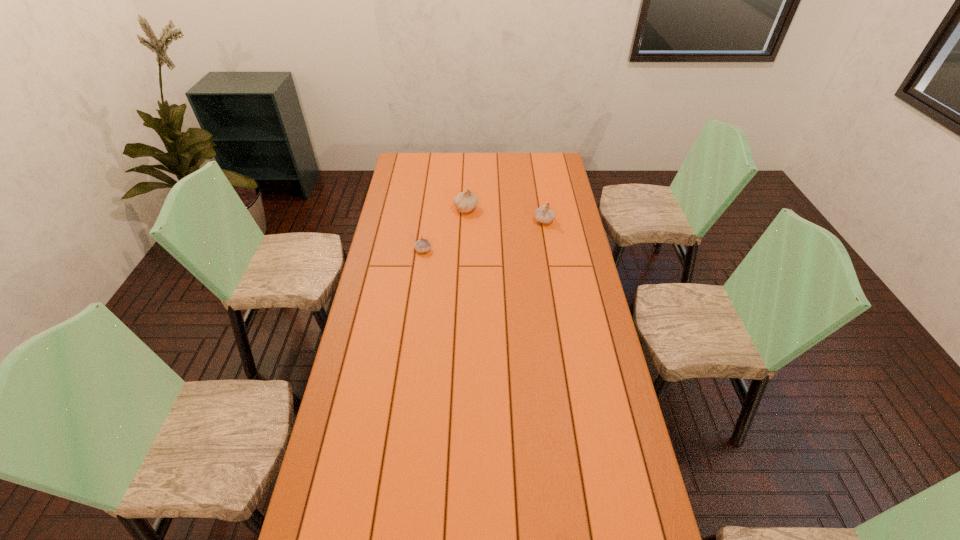
Locate an element on the screen. The width and height of the screenshot is (960, 540). vacant space at the right edge of the desktop is located at coordinates (587, 395).

Identify the location of vacant space at the far left corner of the desktop. pyautogui.click(x=409, y=156).

Where is `vacant space at the far right corner of the desktop`? This screenshot has width=960, height=540. vacant space at the far right corner of the desktop is located at coordinates (543, 168).

Locate an element on the screen. free space between the rightmost object and the second object from left to right is located at coordinates (505, 214).

Where is `vacant space that is in between the rightmost object and the leftmost object`? This screenshot has width=960, height=540. vacant space that is in between the rightmost object and the leftmost object is located at coordinates (484, 235).

In order to click on vacant area between the second garlic from left to right and the leftmost garlic in this screenshot , I will do `click(444, 230)`.

Where is `unoccupied position between the shortest object and the rightmost garlic`? This screenshot has height=540, width=960. unoccupied position between the shortest object and the rightmost garlic is located at coordinates (484, 235).

Select which object appears as the second closest to the nearest garlic. Please provide its 2D coordinates. Your answer should be formatted as a tuple, i.e. [(x, y)], where the tuple contains the x and y coordinates of a point satisfying the conditions above.

[(543, 214)]

Select which object appears as the closest to the nearest object. Please provide its 2D coordinates. Your answer should be formatted as a tuple, i.e. [(x, y)], where the tuple contains the x and y coordinates of a point satisfying the conditions above.

[(466, 201)]

Where is `the closest garlic to the second garlic from left to right`? the closest garlic to the second garlic from left to right is located at coordinates (422, 245).